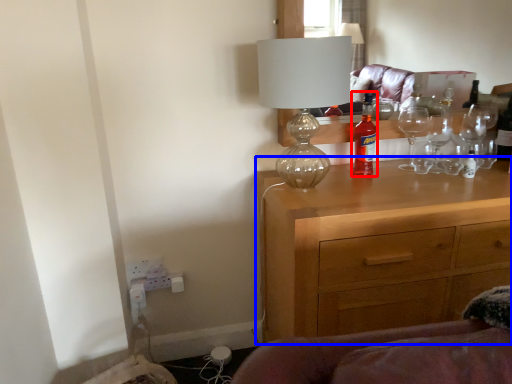
Question: Which point is closer to the camera, bottle (highlighted by a red box) or chest of drawers (highlighted by a blue box)?

Choices:
 (A) bottle
 (B) chest of drawers

Answer: (B)